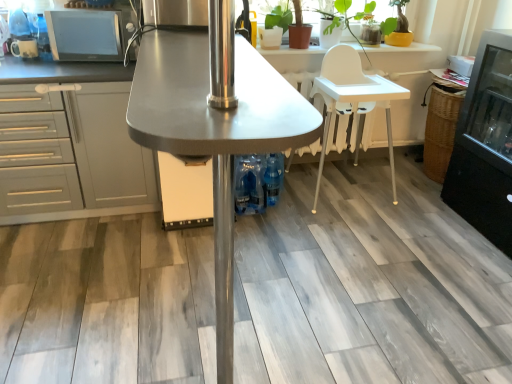
Question: Is blue plastic bottles at center wider than matte black microwave at upper left, which ranks as the 2th appliance in left-to-right order?

Choices:
 (A) no
 (B) yes

Answer: (A)

Question: Considering the relative sizes of blue plastic bottles at center and matte black microwave at upper left, which ranks as the 2th appliance in left-to-right order, in the image provided, is blue plastic bottles at center smaller than matte black microwave at upper left, which ranks as the 2th appliance in left-to-right order,?

Choices:
 (A) yes
 (B) no

Answer: (A)

Question: Does blue plastic bottles at center come behind matte black microwave at upper left, which ranks as the 2th appliance in left-to-right order?

Choices:
 (A) yes
 (B) no

Answer: (A)

Question: From a real-world perspective, is blue plastic bottles at center over matte black microwave at upper left, which is counted as the first appliance, starting from the right?

Choices:
 (A) yes
 (B) no

Answer: (B)

Question: Is blue plastic bottles at center next to matte black microwave at upper left, which ranks as the 2th appliance in left-to-right order?

Choices:
 (A) yes
 (B) no

Answer: (B)

Question: Is blue plastic bottles at center thinner than matte black microwave at upper left, which ranks as the 2th appliance in left-to-right order?

Choices:
 (A) yes
 (B) no

Answer: (A)

Question: Considering the relative sizes of white plastic chair at center and white plastic high chair at center, positioned as the first table in back-to-front order, in the image provided, is white plastic chair at center bigger than white plastic high chair at center, positioned as the first table in back-to-front order,?

Choices:
 (A) yes
 (B) no

Answer: (A)

Question: Is white plastic chair at center wider than white plastic high chair at center, which ranks as the 2th table in left-to-right order?

Choices:
 (A) yes
 (B) no

Answer: (A)

Question: From the image's perspective, is white plastic chair at center above white plastic high chair at center, which ranks as the 2th table in left-to-right order?

Choices:
 (A) no
 (B) yes

Answer: (A)

Question: Is white plastic high chair at center, which is the second table in front-to-back order, at the back of white plastic chair at center?

Choices:
 (A) no
 (B) yes

Answer: (B)

Question: Is white plastic chair at center beside white plastic high chair at center, positioned as the first table in back-to-front order?

Choices:
 (A) no
 (B) yes

Answer: (A)

Question: Can you confirm if white plastic chair at center is taller than white plastic high chair at center, which ranks as the 2th table in left-to-right order?

Choices:
 (A) yes
 (B) no

Answer: (A)

Question: From a real-world perspective, does matte brown pot at upper right sit lower than gray matte cabinet at left?

Choices:
 (A) yes
 (B) no

Answer: (B)